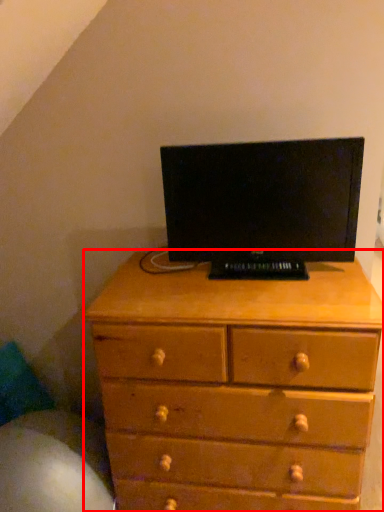
Question: From the image's perspective, considering the relative positions of chest of drawers (annotated by the red box) and computer monitor in the image provided, where is chest of drawers (annotated by the red box) located with respect to the staircase?

Choices:
 (A) below
 (B) above

Answer: (A)